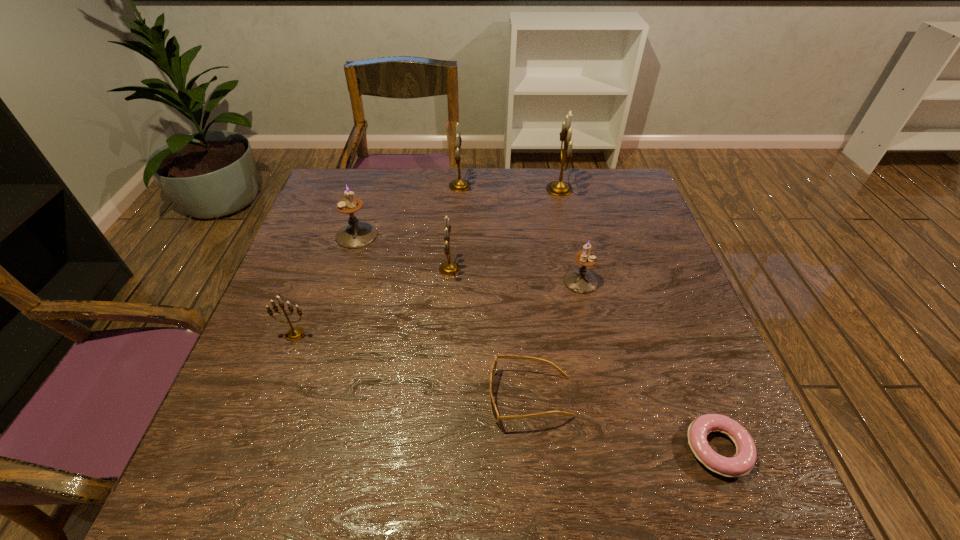
I want to click on free area in between the bigger purple candle holder and the rightmost gold candelabrum, so click(458, 212).

Identify which object is the fifth nearest to the rightmost gold candelabrum. Please provide its 2D coordinates. Your answer should be formatted as a tuple, i.e. [(x, y)], where the tuple contains the x and y coordinates of a point satisfying the conditions above.

[(496, 416)]

Image resolution: width=960 pixels, height=540 pixels. Identify the location of object that ranks as the closest to the shortest object. (496, 416).

Identify which candelabrum is the fourth closest to the seventh shortest object. Please provide its 2D coordinates. Your answer should be formatted as a tuple, i.e. [(x, y)], where the tuple contains the x and y coordinates of a point satisfying the conditions above.

[(580, 280)]

Identify which candelabrum is located as the fourth nearest to the third biggest gold candelabrum. Please provide its 2D coordinates. Your answer should be formatted as a tuple, i.e. [(x, y)], where the tuple contains the x and y coordinates of a point satisfying the conditions above.

[(294, 333)]

Locate which gold candelabrum ranks third in proximity to the tallest object. Please provide its 2D coordinates. Your answer should be formatted as a tuple, i.e. [(x, y)], where the tuple contains the x and y coordinates of a point satisfying the conditions above.

[(294, 333)]

Identify the location of gold candelabrum that is the closest to the sixth farthest object. (449, 268).

Find the location of `free point that satisfies the following two spatial constraints: 1. on the front side of the rightmost gold candelabrum; 2. on the left side of the nearer purple candle holder`. free point that satisfies the following two spatial constraints: 1. on the front side of the rightmost gold candelabrum; 2. on the left side of the nearer purple candle holder is located at coordinates (580, 281).

The height and width of the screenshot is (540, 960). What are the coordinates of `vacant point that satisfies the following two spatial constraints: 1. on the front side of the biggest gold candelabrum; 2. on the left side of the smaller purple candle holder` in the screenshot? It's located at (580, 281).

The image size is (960, 540). I want to click on vacant area that satisfies the following two spatial constraints: 1. on the front side of the nearer purple candle holder; 2. on the right side of the second smallest gold candelabrum, so click(x=449, y=281).